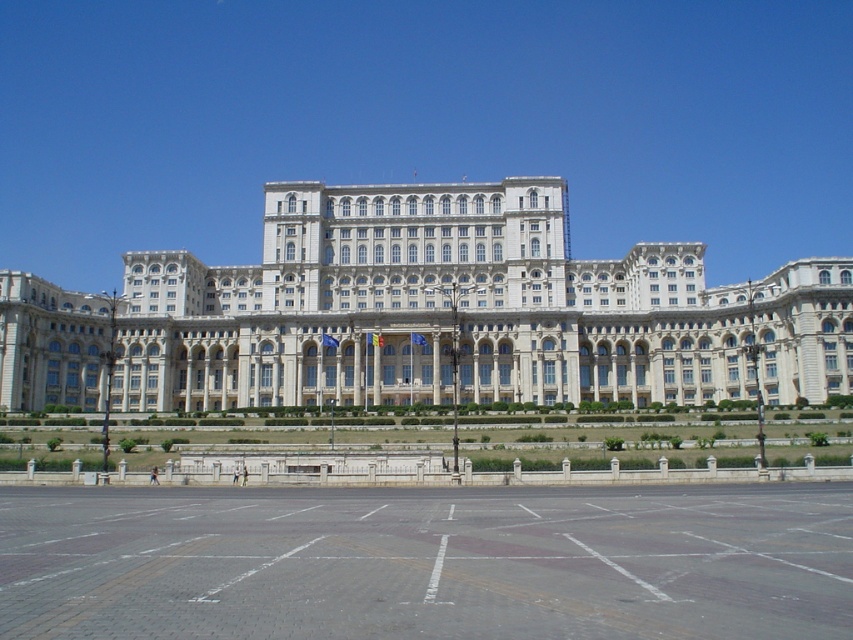
Who is positioned more to the left, white stone building at center or gray brick plaza at lower center?

From the viewer's perspective, gray brick plaza at lower center appears more on the left side.

Find the location of a particular element. Image resolution: width=853 pixels, height=640 pixels. white stone building at center is located at coordinates (425, 314).